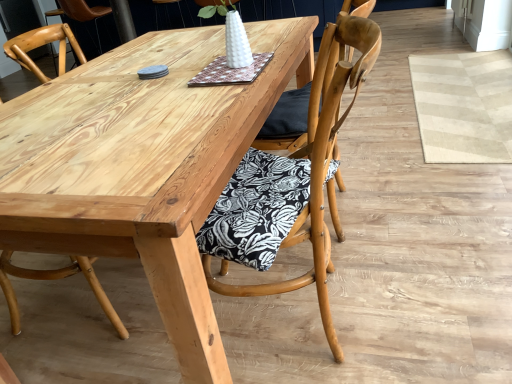
Locate an element on the screen. vacant space to the right of natural wood table at center is located at coordinates (419, 196).